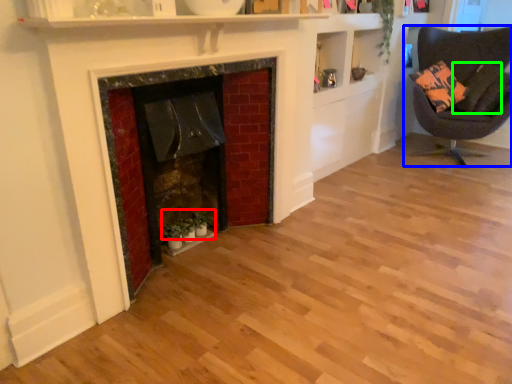
Question: Estimate the real-world distances between objects in this image. Which object is closer to plant (highlighted by a red box), chair (highlighted by a blue box) or pillow (highlighted by a green box)?

Choices:
 (A) chair
 (B) pillow

Answer: (B)